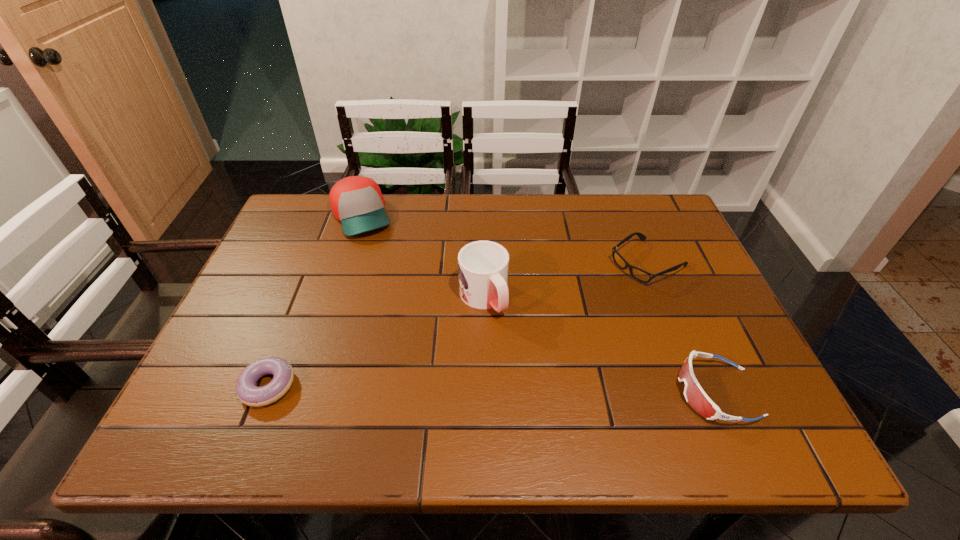
In order to click on vacant space on the desktop that is between the doughnut and the third tallest object and is positioned at the brim of the fourth shortest object in this screenshot , I will do pos(444,388).

Where is `free space on the desktop that is between the shortest object and the third shortest object and is positioned on the front-facing side of the fourth tallest object`? This screenshot has width=960, height=540. free space on the desktop that is between the shortest object and the third shortest object and is positioned on the front-facing side of the fourth tallest object is located at coordinates (446, 388).

Image resolution: width=960 pixels, height=540 pixels. I want to click on free spot on the desktop that is between the doughnut and the goggles and is positioned on the side of the tallest object with the handle, so click(545, 390).